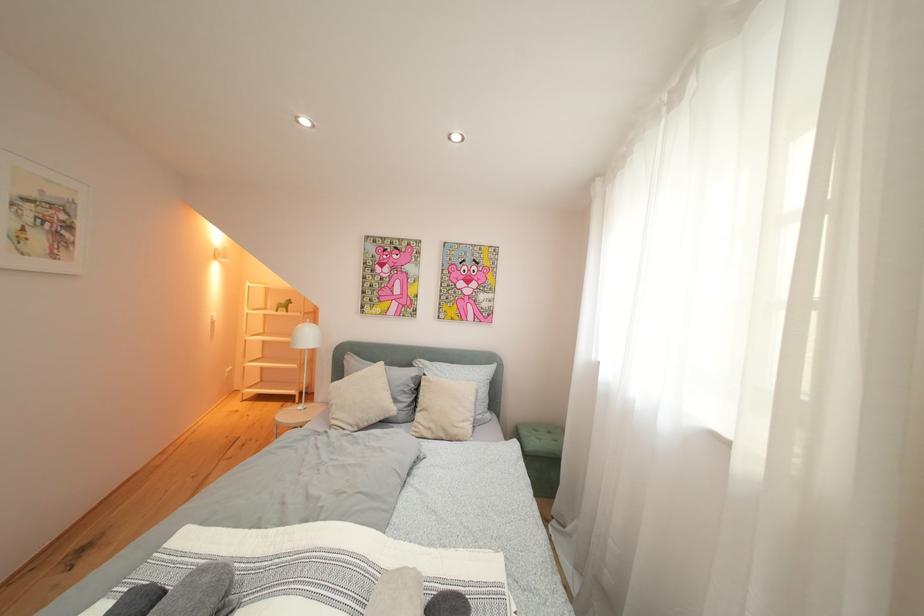
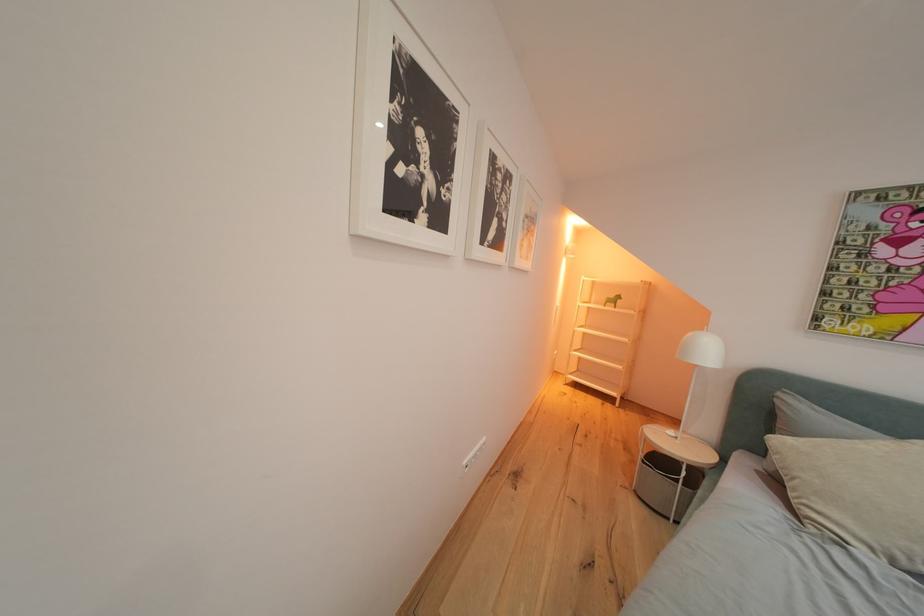
Question: The camera is either moving clockwise (left) or counter-clockwise (right) around the object. The first image is from the beginning of the video and the second image is from the end. Is the camera moving left or right when shooting the video?

Choices:
 (A) Left
 (B) Right

Answer: (B)